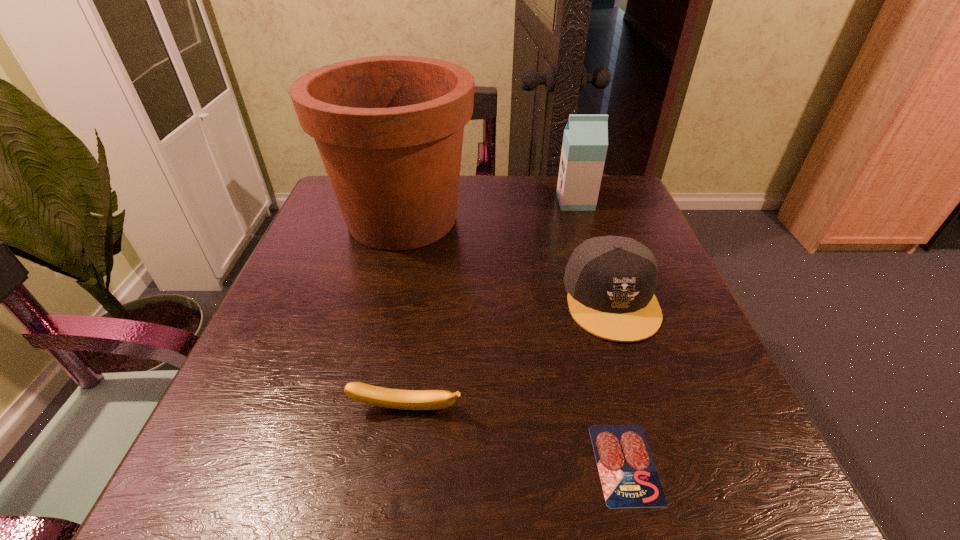
Find the location of a particular element. vacant point that satisfies the following two spatial constraints: 1. at the stem of the fourth farthest object; 2. on the left side of the nearest object is located at coordinates (398, 463).

Find the location of `vacant space that satisfies the following two spatial constraints: 1. at the stem of the salami; 2. on the right side of the second shortest object`. vacant space that satisfies the following two spatial constraints: 1. at the stem of the salami; 2. on the right side of the second shortest object is located at coordinates (398, 463).